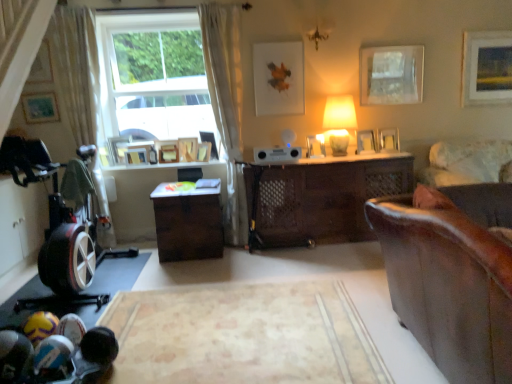
Question: Is the position of matte white lampshade at center-right less distant than that of wooden picture frame at center, the fourth picture frame viewed from the right?

Choices:
 (A) no
 (B) yes

Answer: (B)

Question: Considering the relative positions of matte white lampshade at center-right and wooden picture frame at center, the fourth picture frame viewed from the right, in the image provided, is matte white lampshade at center-right to the left of wooden picture frame at center, the fourth picture frame viewed from the right, from the viewer's perspective?

Choices:
 (A) no
 (B) yes

Answer: (B)

Question: Is matte white lampshade at center-right wider than wooden picture frame at center, the fourth picture frame viewed from the right?

Choices:
 (A) no
 (B) yes

Answer: (B)

Question: From a real-world perspective, is matte white lampshade at center-right located higher than wooden picture frame at center, the eleventh picture frame viewed from the left?

Choices:
 (A) no
 (B) yes

Answer: (B)

Question: From the image's perspective, does matte white lampshade at center-right appear lower than wooden picture frame at center, the eleventh picture frame viewed from the left?

Choices:
 (A) no
 (B) yes

Answer: (A)

Question: In the image, is matte white picture frame at upper left, which is the 1th picture frame in left-to-right order, on the left side or the right side of matte white picture frame at upper center, arranged as the ninth picture frame when viewed from the left?

Choices:
 (A) left
 (B) right

Answer: (A)

Question: Is matte white picture frame at upper left, which is the 1th picture frame in left-to-right order, situated inside matte white picture frame at upper center, arranged as the ninth picture frame when viewed from the left, or outside?

Choices:
 (A) inside
 (B) outside

Answer: (B)

Question: Looking at the image, does matte white picture frame at upper left, which appears as the 14th picture frame when viewed from the right, seem bigger or smaller compared to matte white picture frame at upper center, the 6th picture frame viewed from the right?

Choices:
 (A) small
 (B) big

Answer: (A)

Question: From a real-world perspective, is matte white picture frame at upper left, which appears as the 14th picture frame when viewed from the right, positioned above or below matte white picture frame at upper center, arranged as the ninth picture frame when viewed from the left?

Choices:
 (A) below
 (B) above

Answer: (B)

Question: From the image's perspective, is brown matte desk at center, the 1th desk positioned from the left, above or below matte wooden picture frame at upper left, which ranks as the 2th picture frame in left-to-right order?

Choices:
 (A) below
 (B) above

Answer: (A)

Question: Which is correct: brown matte desk at center, placed as the 2th desk when sorted from right to left, is inside matte wooden picture frame at upper left, which ranks as the 2th picture frame in left-to-right order, or outside of it?

Choices:
 (A) inside
 (B) outside

Answer: (B)

Question: Is brown matte desk at center, placed as the 2th desk when sorted from right to left, bigger or smaller than matte wooden picture frame at upper left, the 13th picture frame positioned from the right?

Choices:
 (A) small
 (B) big

Answer: (B)

Question: From a real-world perspective, is brown matte desk at center, placed as the 2th desk when sorted from right to left, above or below matte wooden picture frame at upper left, which ranks as the 2th picture frame in left-to-right order?

Choices:
 (A) below
 (B) above

Answer: (A)

Question: Is matte wooden picture frame at upper left, the 13th picture frame positioned from the right, wider or thinner than wooden picture frame at upper left, positioned as the 4th picture frame in left-to-right order?

Choices:
 (A) wide
 (B) thin

Answer: (B)

Question: In terms of height, does matte wooden picture frame at upper left, the 13th picture frame positioned from the right, look taller or shorter compared to wooden picture frame at upper left, which appears as the 11th picture frame when viewed from the right?

Choices:
 (A) short
 (B) tall

Answer: (B)